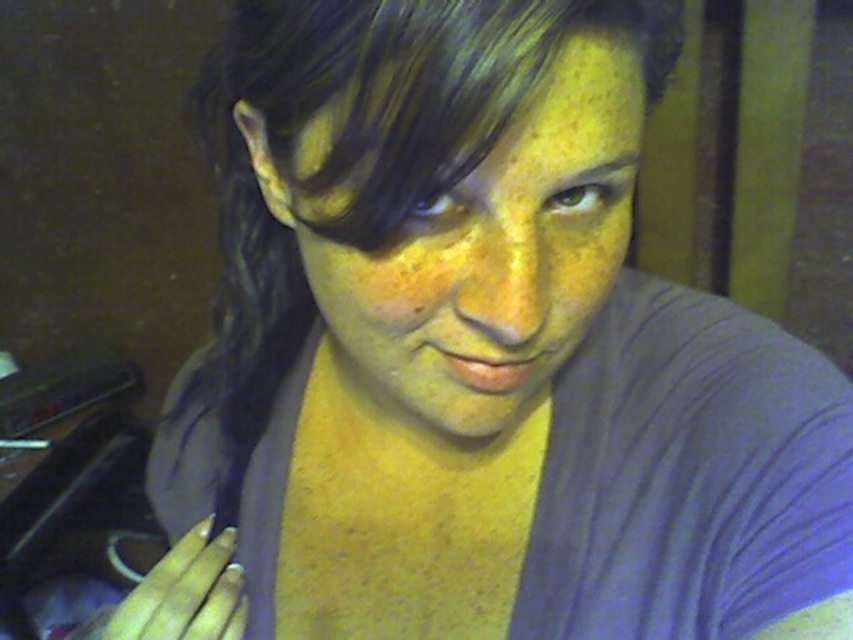
You are taking a photo of a person in a dimly lit room. You notice a point at coordinates (494, 257). What object is located at that point?

The point at coordinates (494, 257) corresponds to the matte gray face at center.

You are taking a photo of the person in the scene. You want to focus on the point closer to the camera. Which point should you choose between point [416,397] and point [224,595]?

Point [416,397] is closer to the camera than point [224,595], so you should choose point [416,397] to focus on.